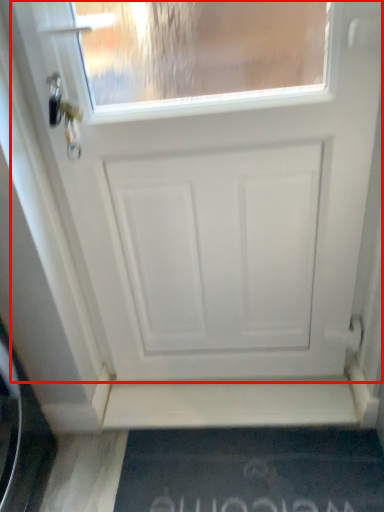
Question: From the image, what is the correct spatial relationship of door (annotated by the red box) in relation to doormat?

Choices:
 (A) left
 (B) right

Answer: (A)